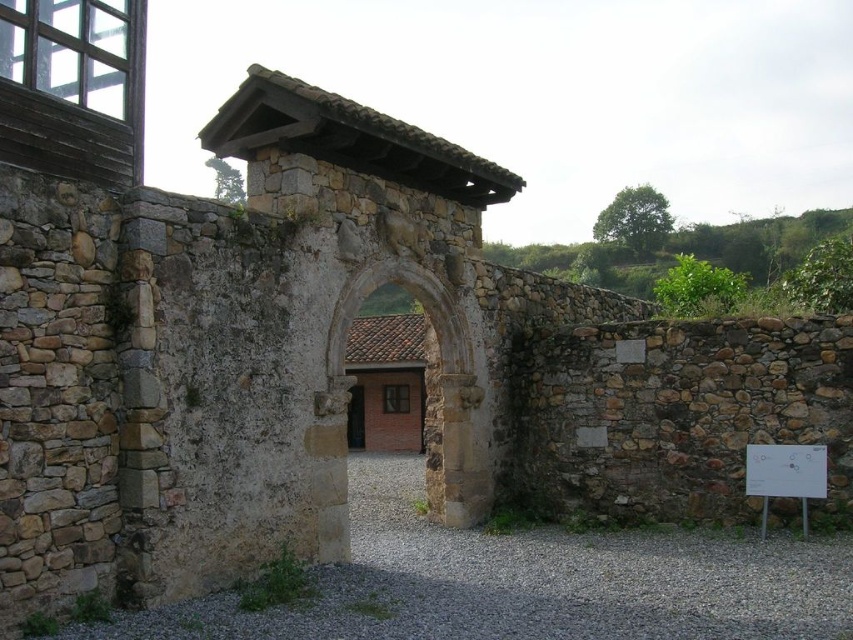
You are standing in front of an ancient stone structure and notice a stone textured archway at center and a white paper at lower right. Which object is nearer to you?

The stone textured archway at center is closer to the viewer than the white paper at lower right.

You are an architect examining the ancient stone structure. You need to compare the widths of the stone textured archway at center and the white paper at lower right. Which one is wider?

The stone textured archway at center is wider than the white paper at lower right according to the description.

You are an archaeologist examining the ancient stone structure. You notice the stone textured archway at center and the white paper at lower right. Which object is positioned to the right side of the other?

The stone textured archway at center is to the left of white paper at lower right, so the white paper at lower right is positioned to the right side of the stone textured archway at center.